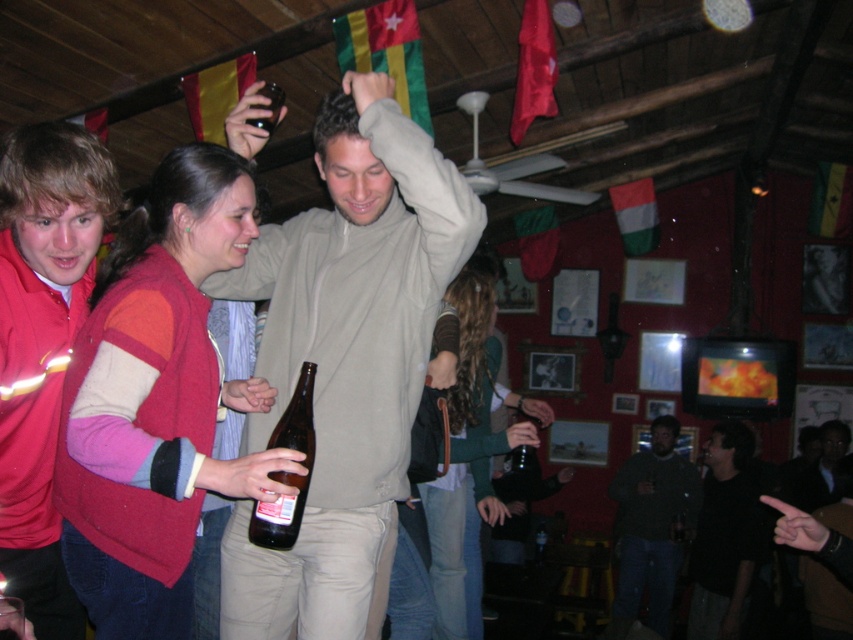
Question: Does knitted sweater at center have a greater width compared to red fleece jacket at left?

Choices:
 (A) yes
 (B) no

Answer: (A)

Question: Does dark gray fabric shirt at center appear under brown glass bottle at upper center?

Choices:
 (A) no
 (B) yes

Answer: (B)

Question: Which of the following is the closest to the observer?

Choices:
 (A) matte beige sweater at center
 (B) green textured sweater at center

Answer: (A)

Question: In this image, where is knitted sweater at center located relative to dark green sweater at center?

Choices:
 (A) right
 (B) left

Answer: (B)

Question: Which point is farther to the camera?

Choices:
 (A) (22, 442)
 (B) (723, 477)

Answer: (B)

Question: Which is farther from the knitted sweater at center?

Choices:
 (A) dark gray fabric shirt at center
 (B) matte beige sweater at center

Answer: (A)